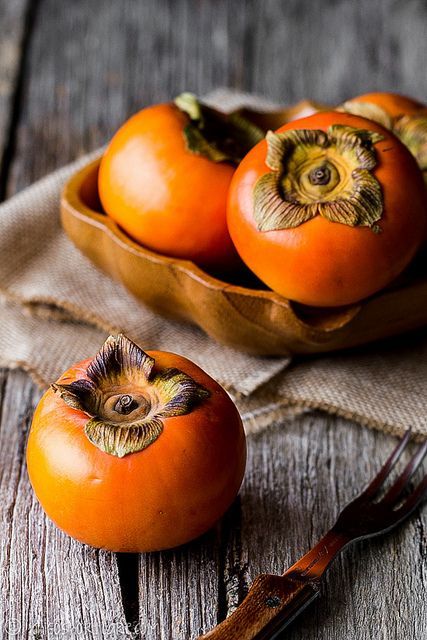
In order to click on corner of placemat in this screenshot , I will do [240, 388].